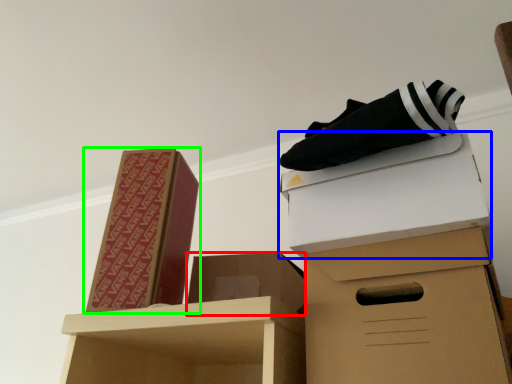
Question: Based on their relative distances, which object is nearer to box (highlighted by a red box)? Choose from box (highlighted by a blue box) and box (highlighted by a green box).

Choices:
 (A) box
 (B) box

Answer: (B)